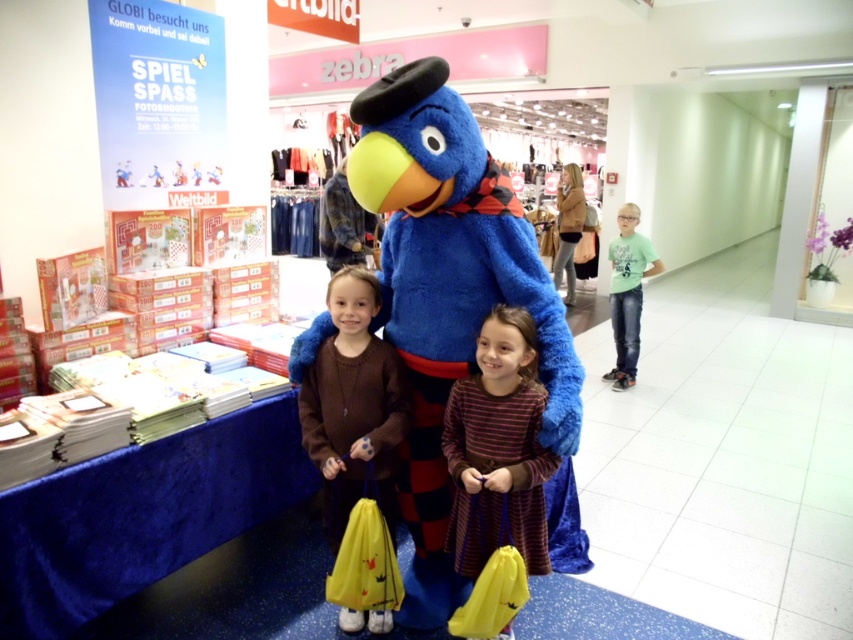
Question: Can you confirm if striped cotton dress at center is positioned to the right of green cotton shirt at right?

Choices:
 (A) yes
 (B) no

Answer: (B)

Question: Can you confirm if blue plush bird at center is positioned to the right of green cotton shirt at right?

Choices:
 (A) yes
 (B) no

Answer: (B)

Question: Which object is the closest to the green cotton shirt at right?

Choices:
 (A) blue plush bird at center
 (B) brown woolen sweater at center

Answer: (A)

Question: Does blue plush bird at center have a smaller size compared to brown woolen sweater at center?

Choices:
 (A) no
 (B) yes

Answer: (A)

Question: Based on their relative distances, which object is farther from the brown woolen sweater at center?

Choices:
 (A) blue plush bird at center
 (B) green cotton shirt at right
 (C) striped cotton dress at center

Answer: (B)

Question: Which object appears closest to the camera in this image?

Choices:
 (A) blue plush bird at center
 (B) green cotton shirt at right
 (C) striped cotton dress at center

Answer: (A)